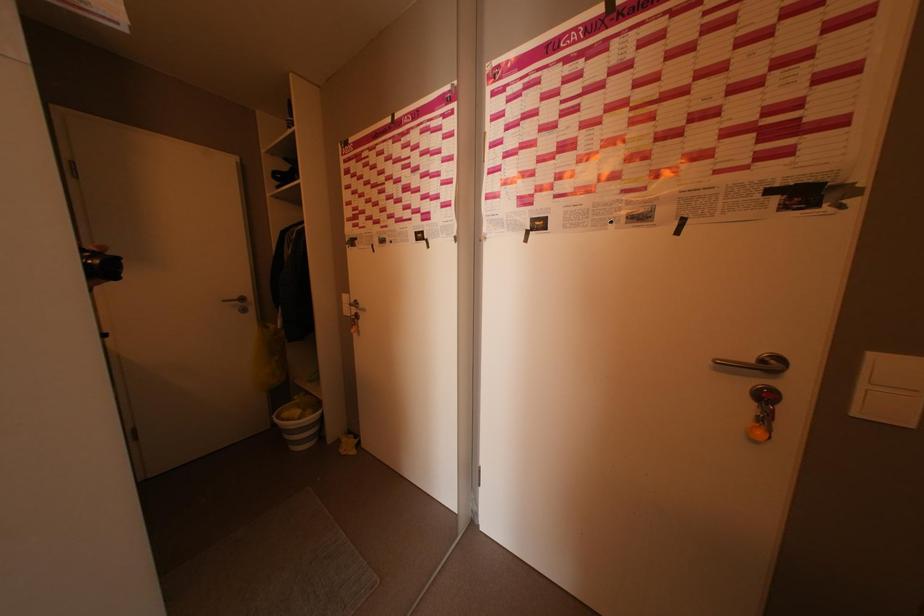
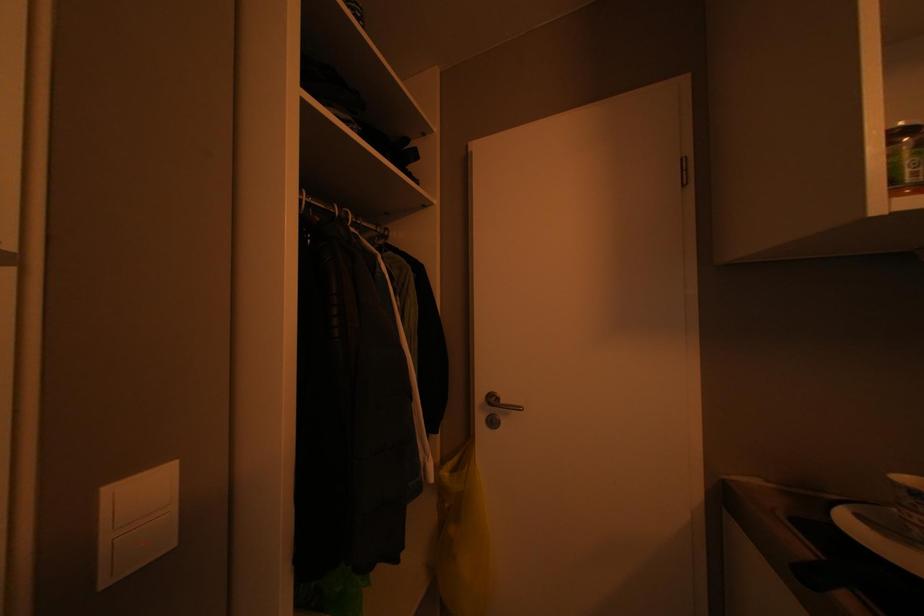
Question: How did the camera likely rotate?

Choices:
 (A) Left
 (B) Right
 (C) Up
 (D) Down

Answer: (B)